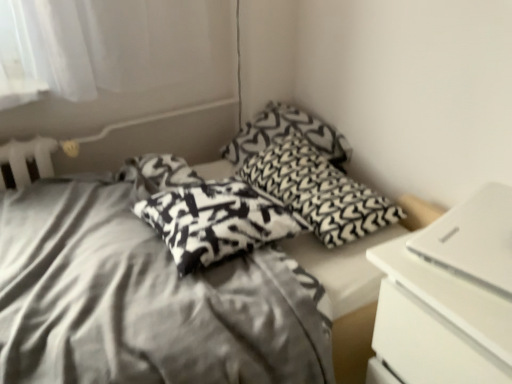
Question: Does black and white patterned pillow at center, the 2th pillow when ordered from front to back, have a larger size compared to silky fabric bed at center?

Choices:
 (A) yes
 (B) no

Answer: (B)

Question: Is black and white patterned pillow at center, which ranks as the second pillow in back-to-front order, in front of silky fabric bed at center?

Choices:
 (A) no
 (B) yes

Answer: (A)

Question: From a real-world perspective, is black and white patterned pillow at center, the 2th pillow when ordered from front to back, on silky fabric bed at center?

Choices:
 (A) no
 (B) yes

Answer: (B)

Question: Is black and white patterned pillow at center, which ranks as the second pillow in back-to-front order, thinner than silky fabric bed at center?

Choices:
 (A) yes
 (B) no

Answer: (A)

Question: Is silky fabric bed at center a part of black and white patterned pillow at center, which ranks as the second pillow in back-to-front order?

Choices:
 (A) yes
 (B) no

Answer: (B)

Question: Relative to white matte laptop at right, is black knitted pillow at center, which is the 1th pillow in back-to-front order, in front or behind?

Choices:
 (A) behind
 (B) front

Answer: (A)

Question: From a real-world perspective, relative to white matte laptop at right, is black knitted pillow at center, placed as the third pillow when sorted from front to back, vertically above or below?

Choices:
 (A) below
 (B) above

Answer: (A)

Question: Considering the positions of black knitted pillow at center, placed as the third pillow when sorted from front to back, and white matte laptop at right in the image, is black knitted pillow at center, placed as the third pillow when sorted from front to back, taller or shorter than white matte laptop at right?

Choices:
 (A) tall
 (B) short

Answer: (A)

Question: In terms of width, does black knitted pillow at center, which is the 1th pillow in back-to-front order, look wider or thinner when compared to white matte laptop at right?

Choices:
 (A) thin
 (B) wide

Answer: (B)

Question: Would you say white matte laptop at right is to the left or to the right of black-and-white printed pillow at center, acting as the 1th pillow starting from the front, in the picture?

Choices:
 (A) left
 (B) right

Answer: (B)

Question: From the image's perspective, is white matte laptop at right above or below black-and-white printed pillow at center, the third pillow from the back?

Choices:
 (A) above
 (B) below

Answer: (B)

Question: Is white matte laptop at right in front of or behind black-and-white printed pillow at center, the third pillow from the back, in the image?

Choices:
 (A) behind
 (B) front

Answer: (B)

Question: From a real-world perspective, relative to black-and-white printed pillow at center, acting as the 1th pillow starting from the front, is white matte laptop at right vertically above or below?

Choices:
 (A) above
 (B) below

Answer: (A)

Question: In terms of width, does white matte laptop at right look wider or thinner when compared to black knitted pillow at center, which is the 1th pillow in back-to-front order?

Choices:
 (A) wide
 (B) thin

Answer: (B)

Question: From the image's perspective, is white matte laptop at right positioned above or below black knitted pillow at center, which is the 1th pillow in back-to-front order?

Choices:
 (A) below
 (B) above

Answer: (A)